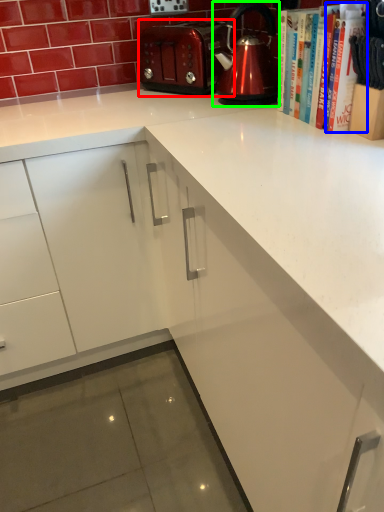
Question: Which object is positioned closest to toaster (highlighted by a red box)? Select from book (highlighted by a blue box) and kettle (highlighted by a green box).

Choices:
 (A) book
 (B) kettle

Answer: (B)